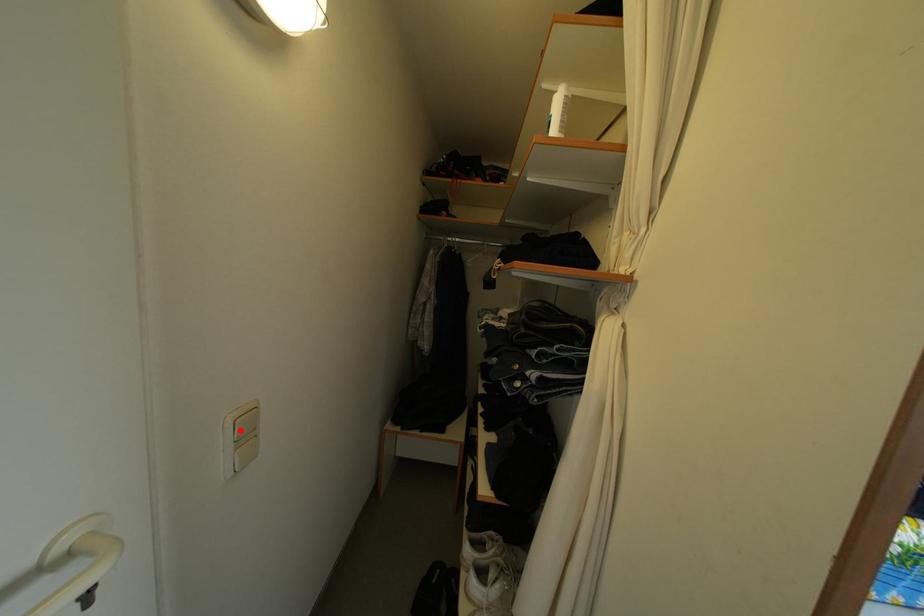
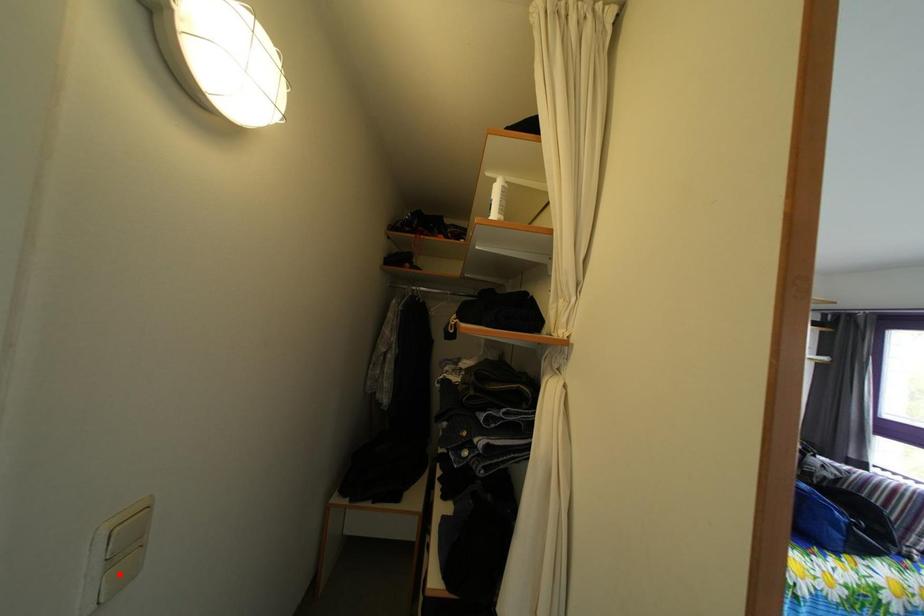
I am providing you with two images of the same scene from different viewpoints. A red point is marked on the first image and another point is marked on the second image. Does the point marked in image1 correspond to the same location as the one in image2?

No